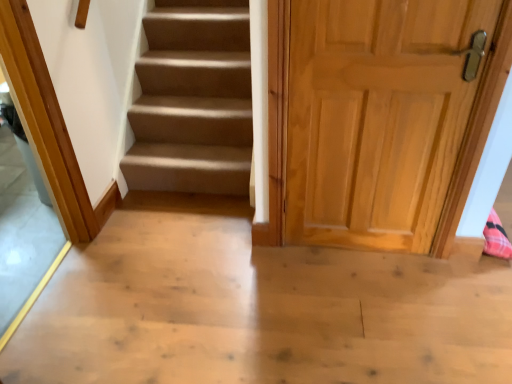
The height and width of the screenshot is (384, 512). I want to click on unoccupied space behind transparent glass door at left, so click(64, 236).